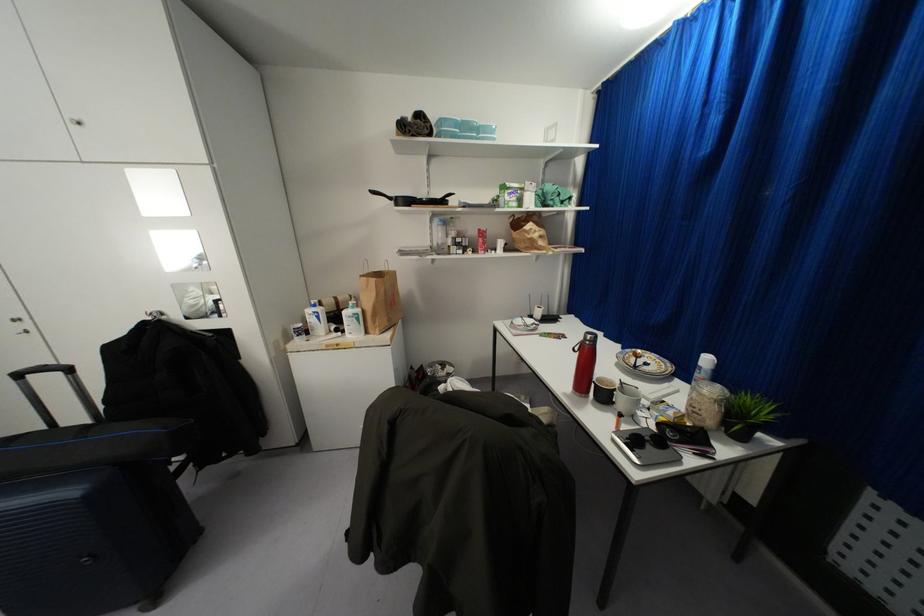
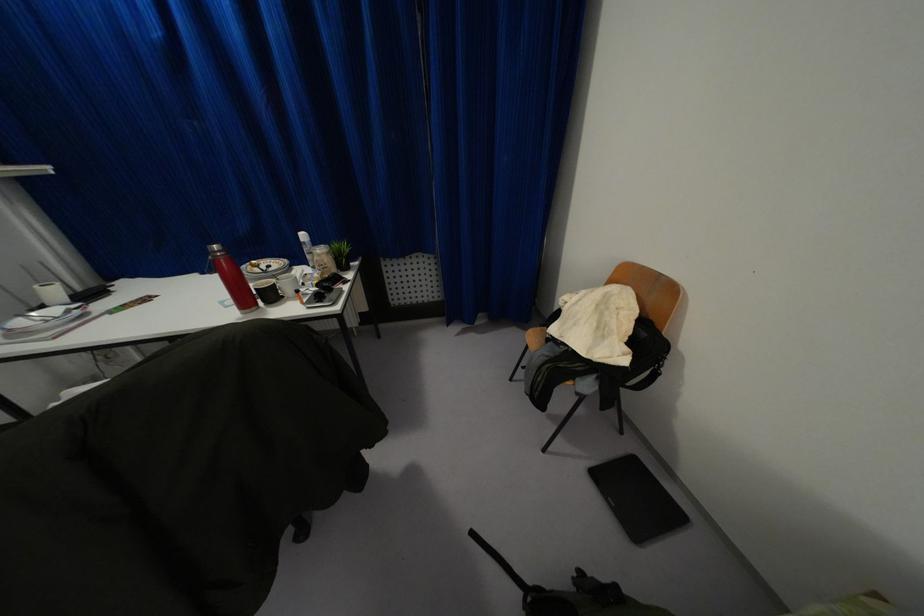
Where in the second image is the point corresponding to (665,384) from the first image?

(294, 270)